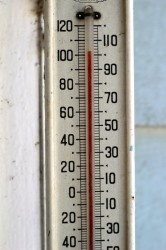
Image resolution: width=166 pixels, height=250 pixels. Find the location of `wall`. wall is located at coordinates 12,156, 154,154.